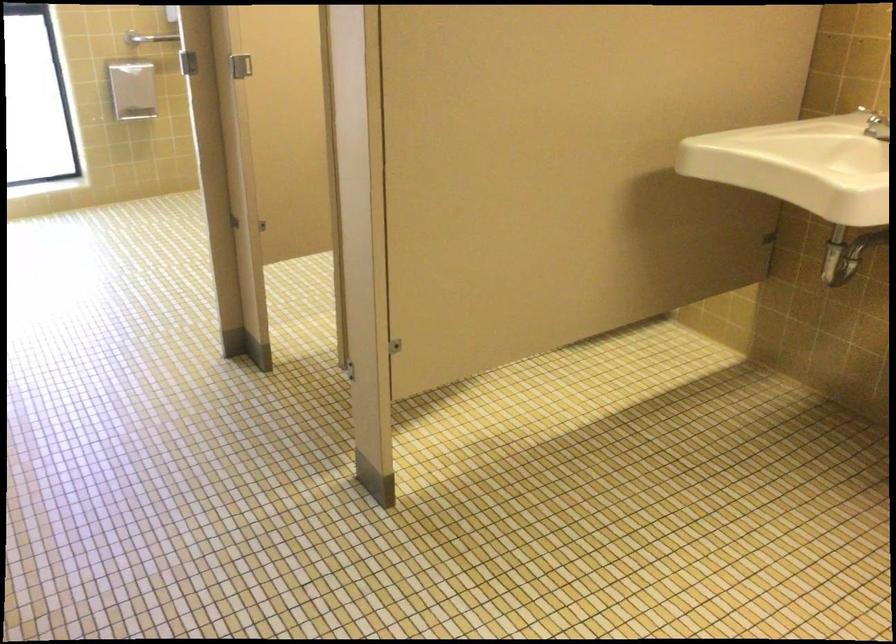
The image size is (896, 644). Identify the location of metal stall latch. (240, 66).